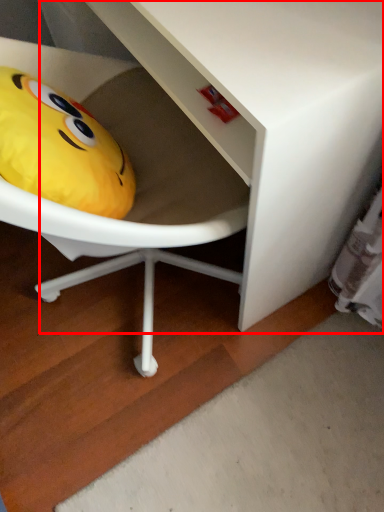
Question: From the image's perspective, considering the relative positions of vanity (annotated by the red box) and toy in the image provided, where is vanity (annotated by the red box) located with respect to the staircase?

Choices:
 (A) below
 (B) above

Answer: (B)